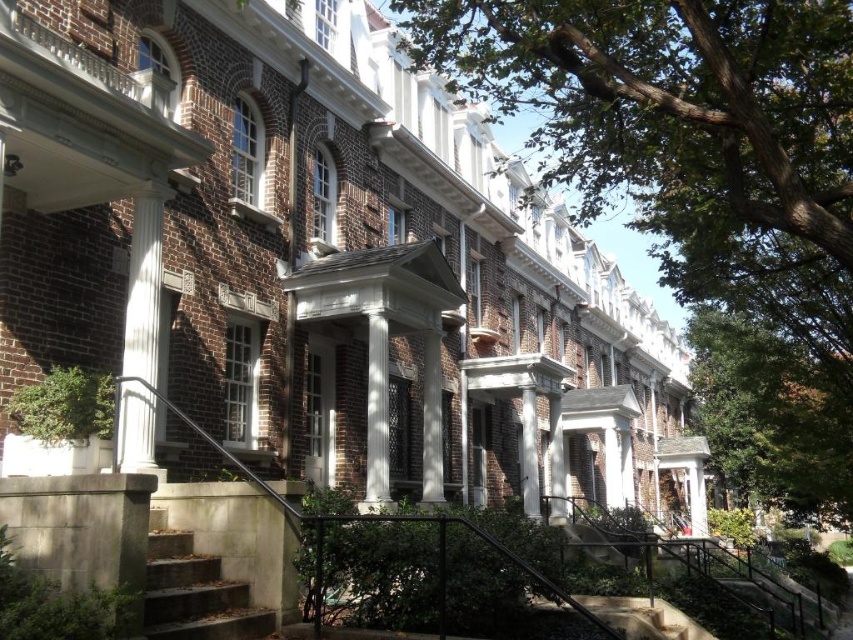
Question: Which point is farther from the camera taking this photo?

Choices:
 (A) [x=549, y=99]
 (B) [x=368, y=410]
 (C) [x=157, y=236]

Answer: (A)

Question: Which point is closer to the camera taking this photo?

Choices:
 (A) click(x=622, y=148)
 (B) click(x=384, y=454)
 (C) click(x=192, y=595)
 (D) click(x=125, y=300)

Answer: (C)

Question: Does white glossy column at left appear on the right side of white smooth column at center?

Choices:
 (A) yes
 (B) no

Answer: (B)

Question: Is green leafy tree at upper right below white smooth column at center?

Choices:
 (A) yes
 (B) no

Answer: (B)

Question: Which object is farther from the camera taking this photo?

Choices:
 (A) concrete steps at lower left
 (B) white glossy column at left
 (C) white smooth column at center

Answer: (C)

Question: Observing the image, what is the correct spatial positioning of green leafy tree at upper right in reference to white glossy column at left?

Choices:
 (A) below
 (B) above

Answer: (B)